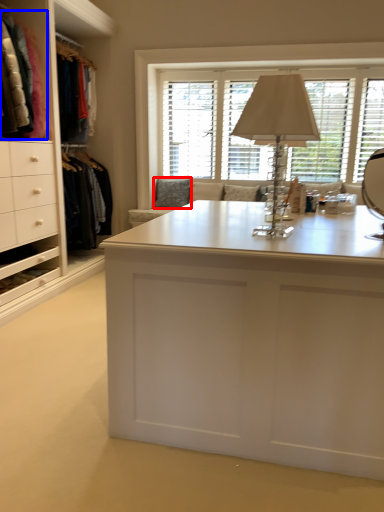
Question: Which object appears closest to the camera in this image, pillow (highlighted by a red box) or clothing (highlighted by a blue box)?

Choices:
 (A) pillow
 (B) clothing

Answer: (B)